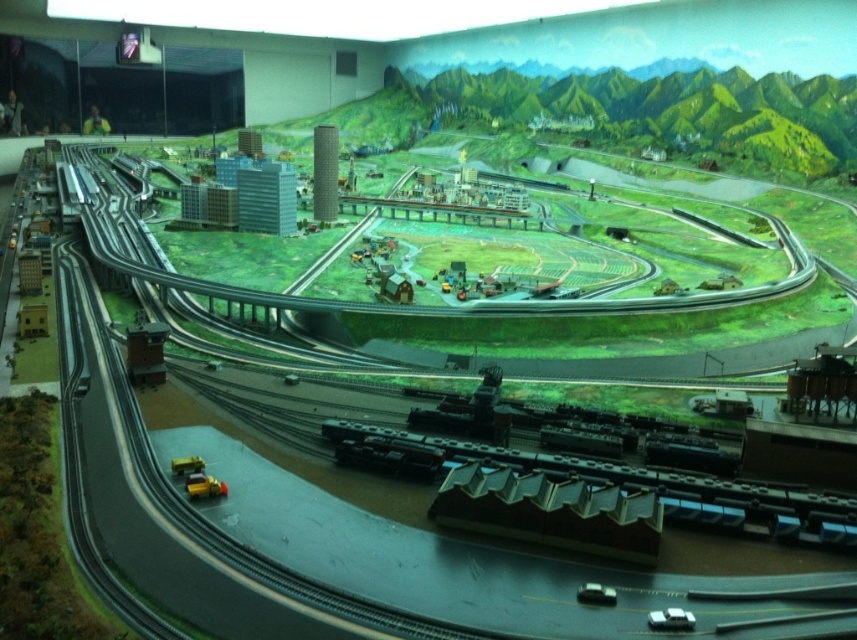
Question: Which point appears closest to the camera in this image?

Choices:
 (A) (189, 481)
 (B) (181, 458)
 (C) (530, 625)
 (D) (699, 486)

Answer: (C)

Question: Can you confirm if shiny silver train at bottom right is bigger than yellow plastic car at lower left?

Choices:
 (A) yes
 (B) no

Answer: (A)

Question: Can you confirm if yellow plastic car at lower left is wider than metallic yellow truck at lower left?

Choices:
 (A) no
 (B) yes

Answer: (B)

Question: Which point is farther to the camera?

Choices:
 (A) (252, 492)
 (B) (217, 483)
 (C) (498, 448)
 (D) (189, 468)

Answer: (C)

Question: Which point is closer to the camera?

Choices:
 (A) shiny silver train at bottom right
 (B) metallic yellow truck at lower left
 (C) metallic gray train track at center
 (D) yellow plastic car at lower left

Answer: (C)

Question: Is yellow plastic car at lower left further to camera compared to metallic yellow truck at lower left?

Choices:
 (A) no
 (B) yes

Answer: (A)